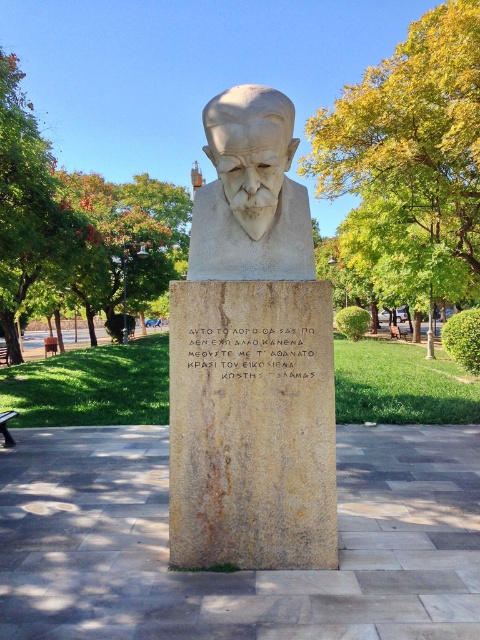
Question: Which of the following is the farthest from the observer?

Choices:
 (A) brushed metal bench at lower left
 (B) gray stone inscription at center
 (C) brown wooden park bench at center

Answer: (C)

Question: Among these objects, which one is nearest to the camera?

Choices:
 (A) brown wooden bench at lower left
 (B) brown wooden park bench at center
 (C) white stone bust at center

Answer: (C)

Question: Considering the relative positions of matte stone bust at center and gray stone inscription at center in the image provided, where is matte stone bust at center located with respect to gray stone inscription at center?

Choices:
 (A) left
 (B) right

Answer: (A)

Question: Is gray stone inscription at center bigger than brushed metal bench at lower left?

Choices:
 (A) no
 (B) yes

Answer: (A)

Question: Which object appears closest to the camera in this image?

Choices:
 (A) brown wooden bench at lower left
 (B) gray stone inscription at center

Answer: (B)

Question: In this image, where is gray stone inscription at center located relative to brown wooden bench at lower left?

Choices:
 (A) above
 (B) below

Answer: (A)